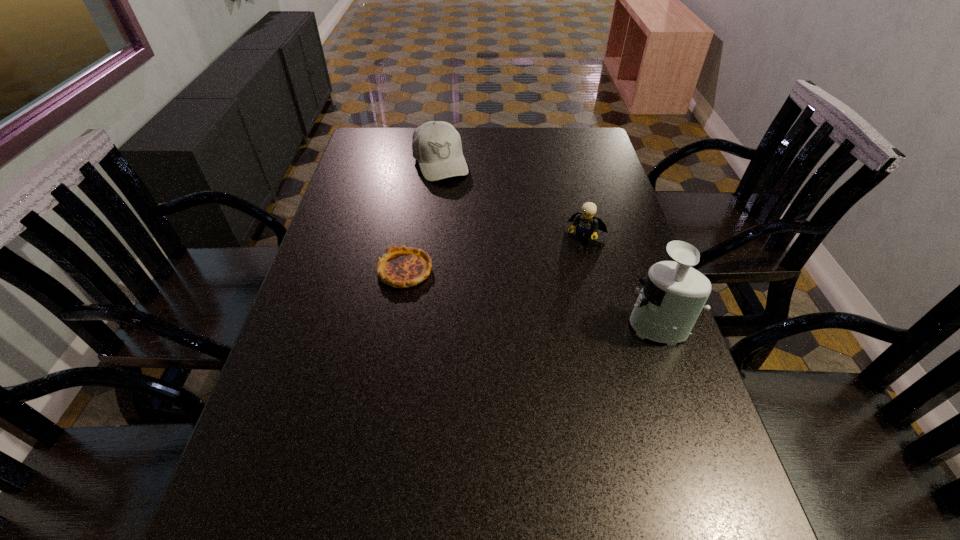
You are a GUI agent. You are given a task and a screenshot of the screen. Output one action in this format:
    pyautogui.click(x=<x>, y=<y>)
    Task: Click on the free spot on the desktop that is between the third farthest object and the tallest object and is positioned on the front-facing side of the farthest object
    
    Given the screenshot: What is the action you would take?
    pyautogui.click(x=505, y=292)

Locate an element on the screen. free space on the desktop that is between the shortest object and the tallest object and is positioned on the front-facing side of the Lego is located at coordinates (552, 302).